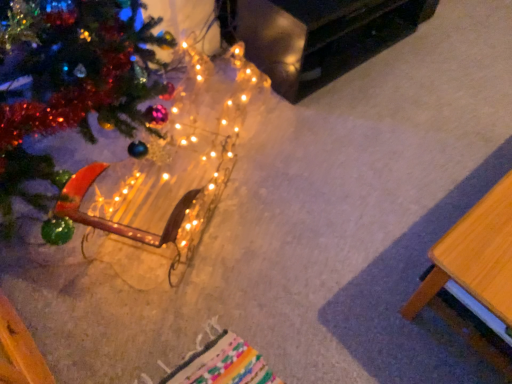
Identify the location of empty space that is in between black glossy table at upper right, which is the first table in top-to-bottom order, and wooden table at lower right, marked as the 1th table in a front-to-back arrangement. (390, 139).